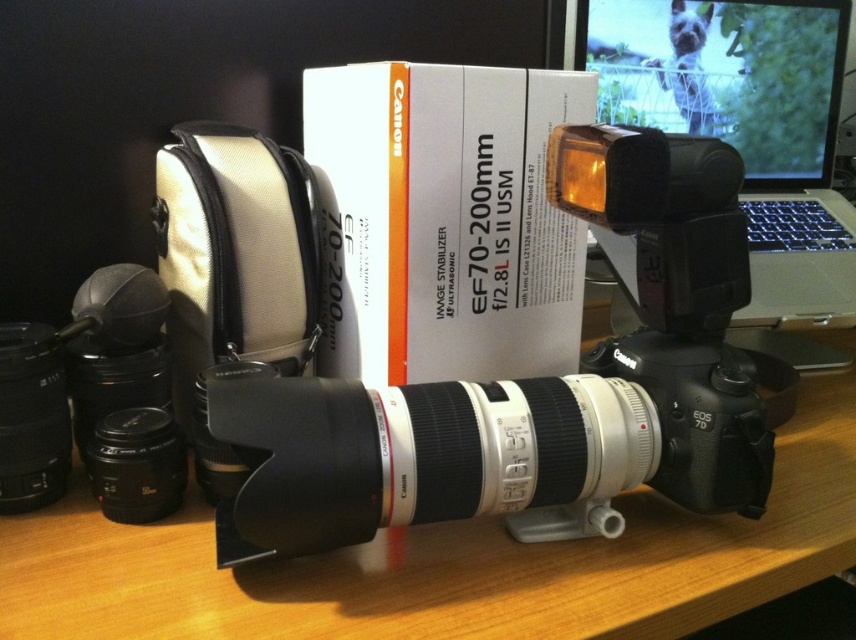
You are setting up a photography studio and need to place a Canon camera setup on the wooden table at center. However, there is a white cardboard box at center in the way. Based on their positions, which object should you move to make space for the camera setup?

The white cardboard box at center is on the left side of the wooden table at center, so you should move the white cardboard box at center to make space for the camera setup.

You are a photographer setting up your Canon EOS 7D camera on a desk. You notice a white cardboard box at center and the black plastic camera at center. Which object is closer to you, the photographer?

The black plastic camera at center is closer to you because it is positioned in front of the white cardboard box at center.

You are setting up a photography station and need to place the white cardboard box at center and the silver metallic laptop at upper right on the desk. Given their dimensions, which object should you place first to ensure stability?

The white cardboard box at center is thinner than the silver metallic laptop at upper right, so you should place the silver metallic laptop at upper right first to ensure stability as it has a larger base.